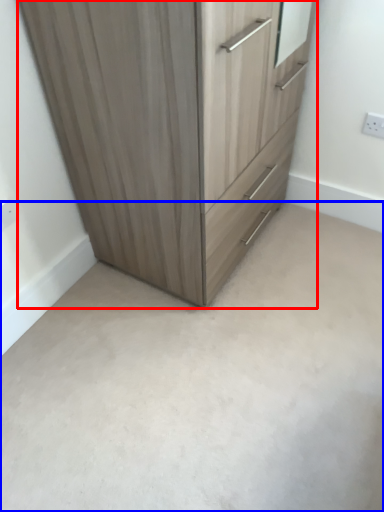
Question: Which point is further to the camera, chest of drawers (highlighted by a red box) or concrete (highlighted by a blue box)?

Choices:
 (A) chest of drawers
 (B) concrete

Answer: (B)